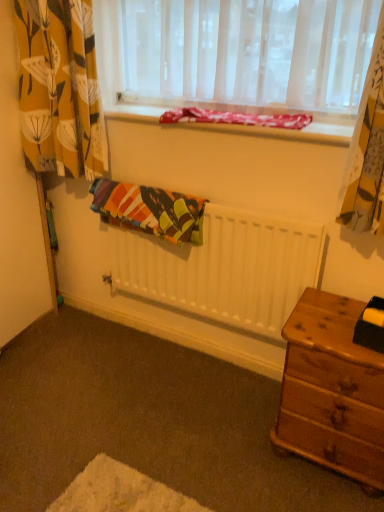
Question: Considering the positions of yellow floral fabric at left and translucent fabric at upper center in the image, is yellow floral fabric at left bigger or smaller than translucent fabric at upper center?

Choices:
 (A) big
 (B) small

Answer: (B)

Question: Is point (74, 38) positioned closer to the camera than point (168, 30)?

Choices:
 (A) closer
 (B) farther

Answer: (A)

Question: Which is farther from the wooden nightstand at lower right?

Choices:
 (A) translucent fabric at upper center
 (B) textured fabric at upper center
 (C) multicolored fabric at center
 (D) white matte radiator at center
 (E) yellow floral fabric at left

Answer: (E)

Question: Considering the real-world distances, which object is closest to the textured fabric at upper center?

Choices:
 (A) white matte radiator at center
 (B) translucent fabric at upper center
 (C) wooden nightstand at lower right
 (D) yellow floral fabric at left
 (E) multicolored fabric at center

Answer: (B)